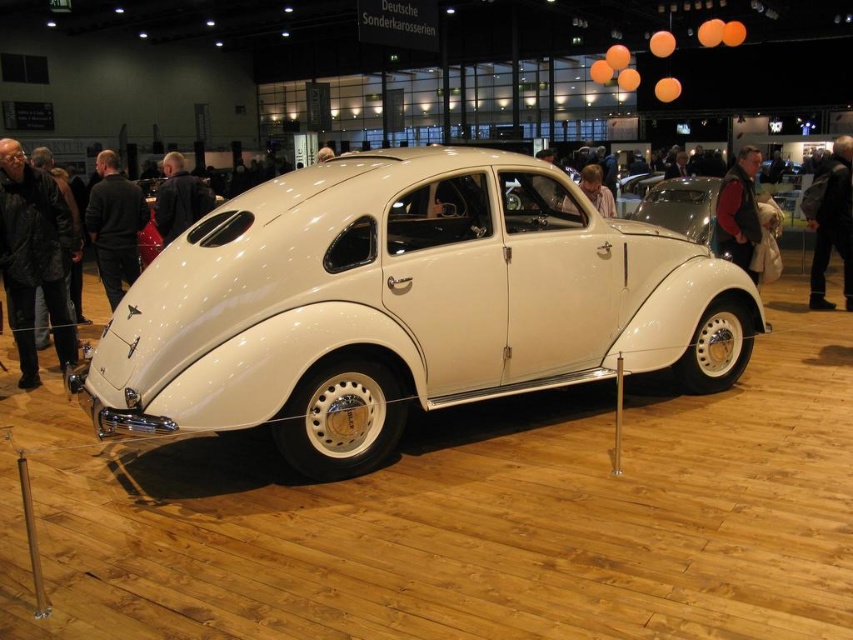
You are a visitor at the car exhibition and want to take a photo of the matte white car at center without any obstructions. However, there is a dark blue leather jacket at center in the way. Can you move the jacket to the side to get a clear shot?

The dark blue leather jacket at center is positioned under the matte white car at center, so moving it to the side would allow you to take an unobstructed photo of the matte white car at center.

You are a photographer planning to take a photo of the matte white car at center. You notice a black leather jacket at right in the background. Since the jacket might distract from the car, can you estimate whether the jacket is small enough to avoid being a prominent distraction in the photo?

The black leather jacket at right has a smaller size compared to matte white car at center, so it is less likely to be a prominent distraction in the photo.

You are a visitor at the car exhibition and want to see both the black leather jacket at right and the dark red leather jacket at center. Which jacket should you move closer to first to see both without moving past the ropes?

You should move closer to the black leather jacket at right first because the dark red leather jacket at center is behind it. By approaching the black one first, you can then step aside to view the dark red one without needing to move past the ropes.